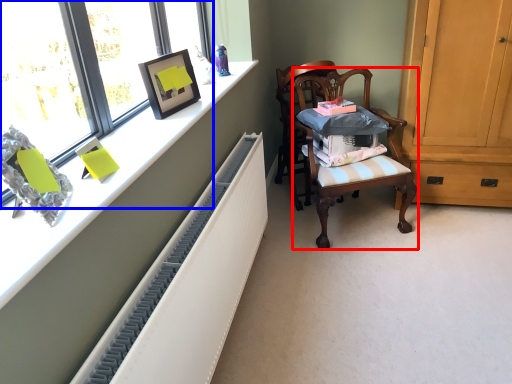
Question: Among these objects, which one is farthest to the camera, chair (highlighted by a red box) or window (highlighted by a blue box)?

Choices:
 (A) chair
 (B) window

Answer: (A)